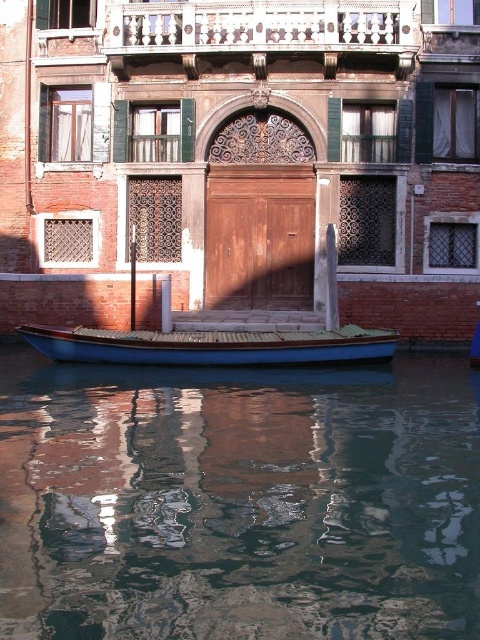
You are standing on the canal side and want to board the blue polished wood boat at center. Which direction should you walk to reach it from the smooth glass water at lower center?

The smooth glass water at lower center is in front of the blue polished wood boat at center, so you should walk towards the blue polished wood boat at center from the smooth glass water at lower center.

You are a tourist standing on the canal side and want to take a photo of the smooth glass water at lower center and the blue polished wood boat at center. Which object in the scene is bigger?

The smooth glass water at lower center is larger in size than the blue polished wood boat at center.